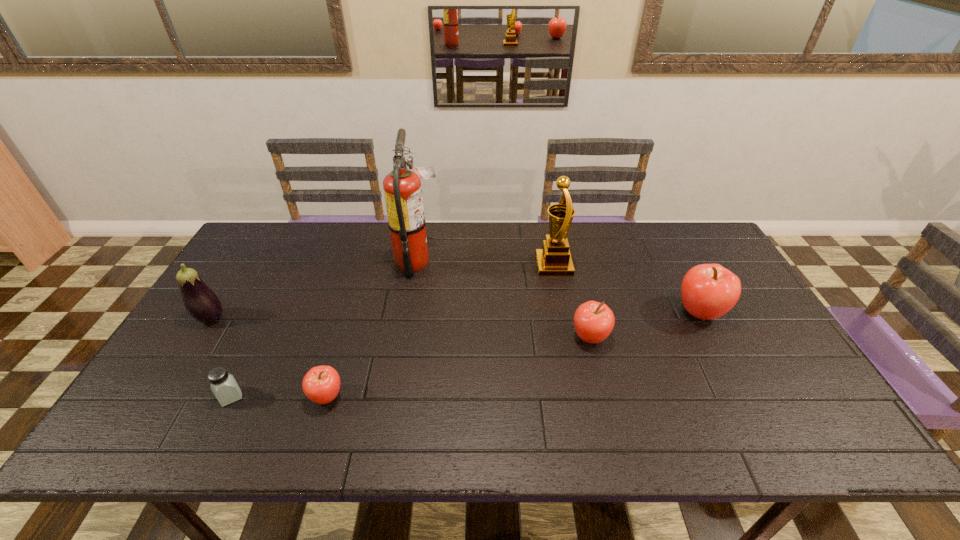
I want to click on saltshaker, so click(x=224, y=386).

What are the coordinates of `free space located 0.200m on the back of the third object from left to right` in the screenshot? It's located at (349, 322).

Where is `free space located on the right of the second tallest apple`? free space located on the right of the second tallest apple is located at coordinates (757, 338).

Where is `free spot located on the back of the rightmost object`? The width and height of the screenshot is (960, 540). free spot located on the back of the rightmost object is located at coordinates click(677, 269).

This screenshot has width=960, height=540. In order to click on free space located from the nozzle of the fourth object from right to left in this screenshot , I will do `click(490, 262)`.

Find the location of a particular element. vacant space situated 0.360m on the front-facing side of the award is located at coordinates (425, 266).

Identify the location of free space located on the front-facing side of the award. Image resolution: width=960 pixels, height=540 pixels. (468, 266).

Image resolution: width=960 pixels, height=540 pixels. What are the coordinates of `vacant region located on the front-facing side of the award` in the screenshot? It's located at (421, 266).

Where is `free space located on the back of the leftmost object`? The height and width of the screenshot is (540, 960). free space located on the back of the leftmost object is located at coordinates (256, 245).

The height and width of the screenshot is (540, 960). What are the coordinates of `vacant region located on the right of the second object from left to right` in the screenshot? It's located at (327, 397).